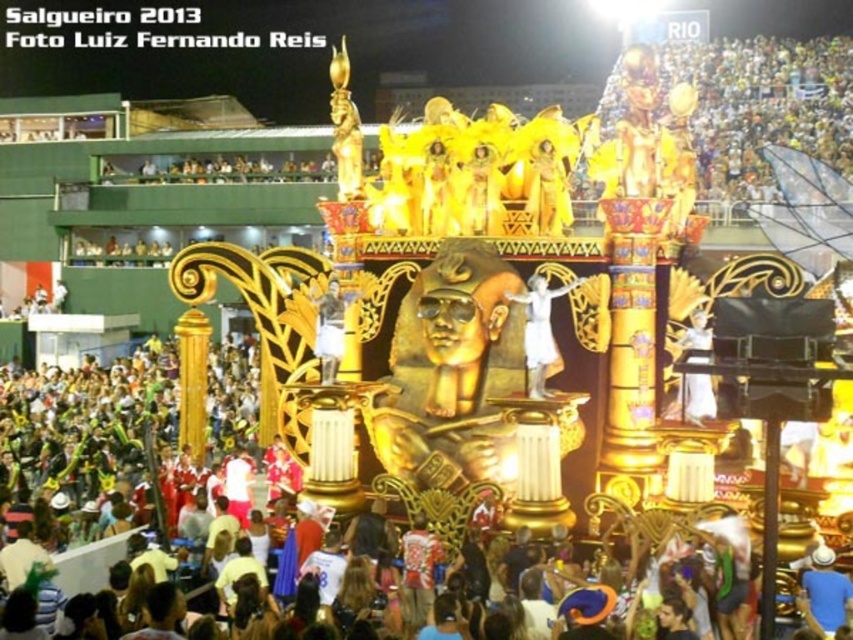
Question: Does white satin dress at center appear on the right side of metallic gold statue at center?

Choices:
 (A) yes
 (B) no

Answer: (A)

Question: Which point appears farthest from the camera in this image?

Choices:
 (A) (694, 410)
 (B) (321, 358)

Answer: (B)

Question: In this image, where is white satin dress at center located relative to golden statue at center?

Choices:
 (A) above
 (B) below

Answer: (B)

Question: Which of the following is the farthest from the observer?

Choices:
 (A) metallic gold statue at center
 (B) golden statue at center
 (C) white satin dress at center

Answer: (A)

Question: Can you confirm if white satin dress at center is smaller than golden statue at center?

Choices:
 (A) no
 (B) yes

Answer: (B)

Question: Which object is farther from the camera taking this photo?

Choices:
 (A) white satin dress at center
 (B) metallic gold statue at center
 (C) golden statue at center

Answer: (B)